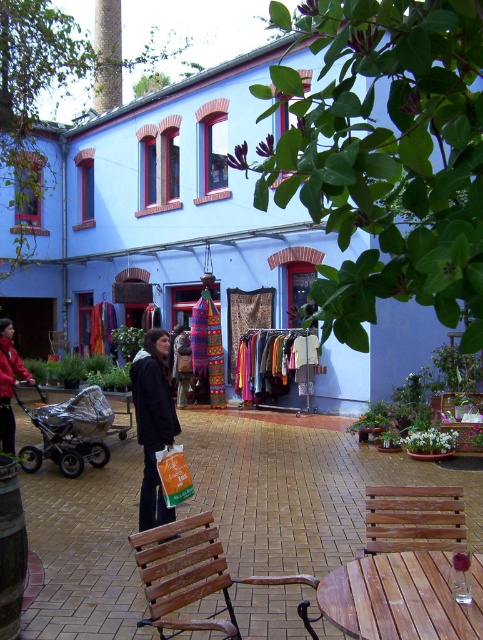
You are designing a layout for a small garden that needs to accommodate both the wooden bench at center and the red fleece jacket at left. Given their sizes, which object requires more horizontal space to place?

The wooden bench at center requires more horizontal space because its width surpasses that of the red fleece jacket at left.

You are standing at the entrance of the light blue building with red windows and see the wooden bench at lower center and the black fabric bag at center. Which object is shorter?

The wooden bench at lower center is not as tall as the black fabric bag at center, so the wooden bench at lower center is shorter.